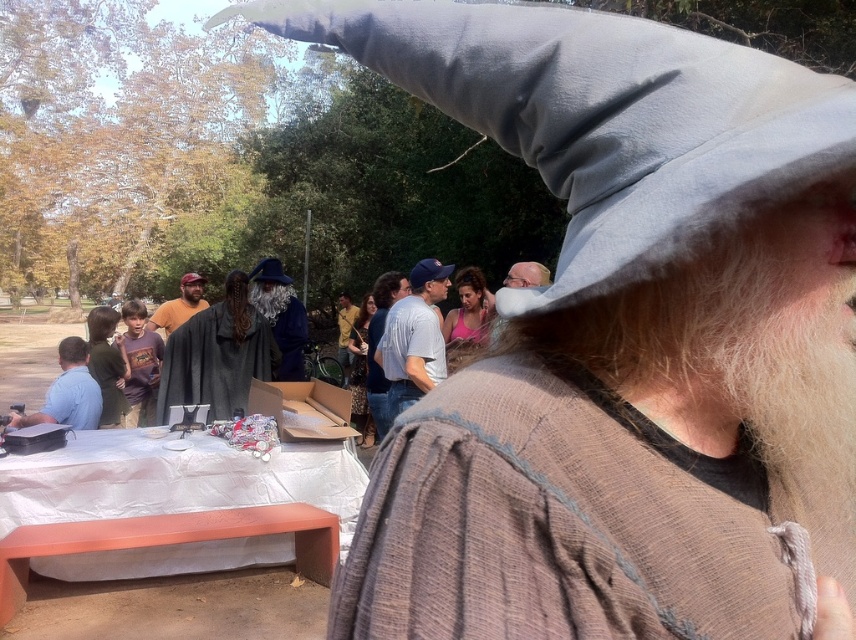
Does orange painted wood picnic table at lower left appear on the left side of velvet blue robe at center?

Correct, you'll find orange painted wood picnic table at lower left to the left of velvet blue robe at center.

Between orange painted wood picnic table at lower left and velvet blue robe at center, which one is positioned higher?

velvet blue robe at center is higher up.

Is point (235, 548) more distant than point (306, 317)?

That is False.

Find the location of `orange painted wood picnic table at lower left`. orange painted wood picnic table at lower left is located at coordinates (171, 509).

Measure the distance from matte brown shirt at center to blue fabric baseball cap at center.

A distance of 2.47 meters exists between matte brown shirt at center and blue fabric baseball cap at center.

Does matte brown shirt at center appear over blue fabric baseball cap at center?

Indeed, matte brown shirt at center is positioned over blue fabric baseball cap at center.

Is point (171, 301) more distant than point (424, 272)?

That is True.

Find the location of a particular element. This screenshot has height=640, width=856. matte brown shirt at center is located at coordinates (179, 305).

Measure the distance between point (389, 401) and camera.

3.79 meters

Does point (415, 278) come behind point (337, 317)?

No.

At what (x,y) coordinates should I click in order to perform the action: click on light blue denim jeans at center. Please return your answer as a coordinate pair (x, y). The width and height of the screenshot is (856, 640). Looking at the image, I should click on (414, 337).